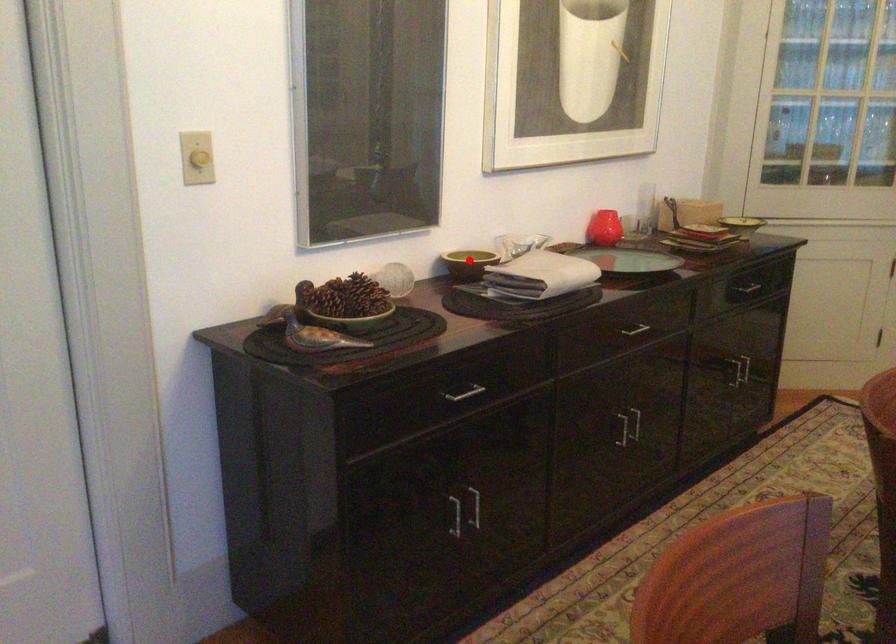
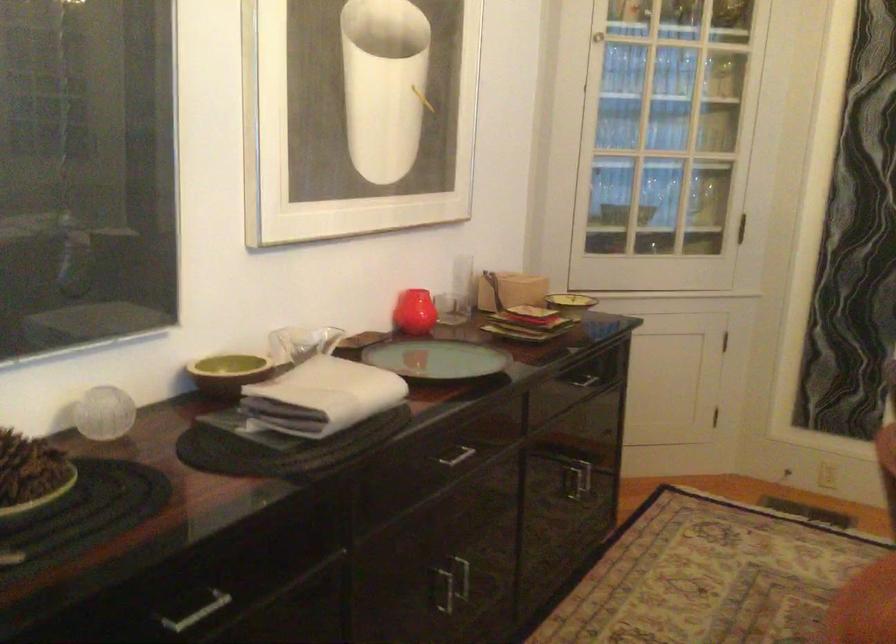
Question: A red point is marked in image1. In image2, is the corresponding 3D point closer to the camera or farther? Reply with the corresponding letter.

Choices:
 (A) The corresponding 3D point is closer.
 (B) The corresponding 3D point is farther.

Answer: (A)